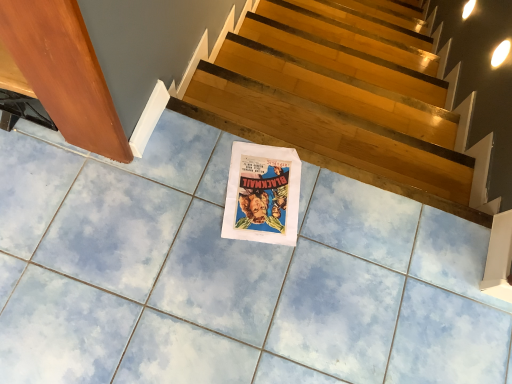
In order to click on vacant area located to the right-hand side of white paper at center in this screenshot , I will do `click(334, 225)`.